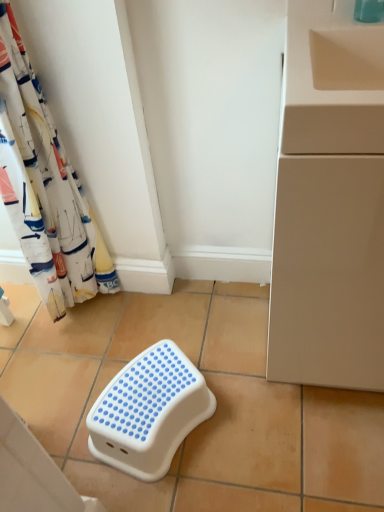
The width and height of the screenshot is (384, 512). What are the coordinates of `vacant area on the back side of beige ceramic tile at lower left, acting as the 2th ceramic tile starting from the right` in the screenshot? It's located at (49, 376).